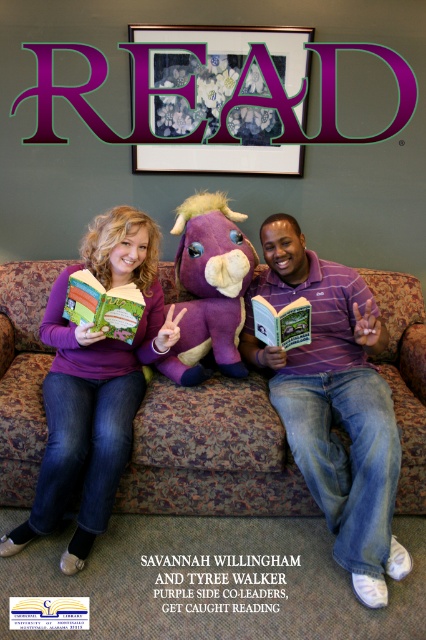
This screenshot has height=640, width=426. What do you see at coordinates (212, 452) in the screenshot?
I see `brown floral fabric couch at center` at bounding box center [212, 452].

Can you confirm if brown floral fabric couch at center is positioned below hardcover book at center?

Indeed, brown floral fabric couch at center is positioned under hardcover book at center.

In the scene shown: Who is more distant from viewer, (399, 321) or (109, 300)?

The point (399, 321) is more distant.

You are a GUI agent. You are given a task and a screenshot of the screen. Output one action in this format:
    pyautogui.click(x=<x>, y=<y>)
    Task: Click on the brown floral fabric couch at center
    The width and height of the screenshot is (426, 640).
    Given the screenshot: What is the action you would take?
    pyautogui.click(x=212, y=452)

Can you confirm if brown floral fabric couch at center is thinner than purple plush stuffed animal at center?

In fact, brown floral fabric couch at center might be wider than purple plush stuffed animal at center.

Does brown floral fabric couch at center come behind purple plush stuffed animal at center?

No, it is not.

From the picture: Who is more forward, (138,436) or (203,323)?

Point (138,436) is more forward.

Find the location of `brown floral fabric couch at center`. brown floral fabric couch at center is located at coordinates (212, 452).

Which is below, brown floral fabric couch at center or purple matte book at center?

Positioned lower is brown floral fabric couch at center.

Can you confirm if brown floral fabric couch at center is shorter than purple matte book at center?

No, brown floral fabric couch at center is not shorter than purple matte book at center.

Is point (29, 369) more distant than point (288, 308)?

Yes, it is.

At what (x,y) coordinates should I click in order to perform the action: click on brown floral fabric couch at center. Please return your answer as a coordinate pair (x, y). Looking at the image, I should click on (212, 452).